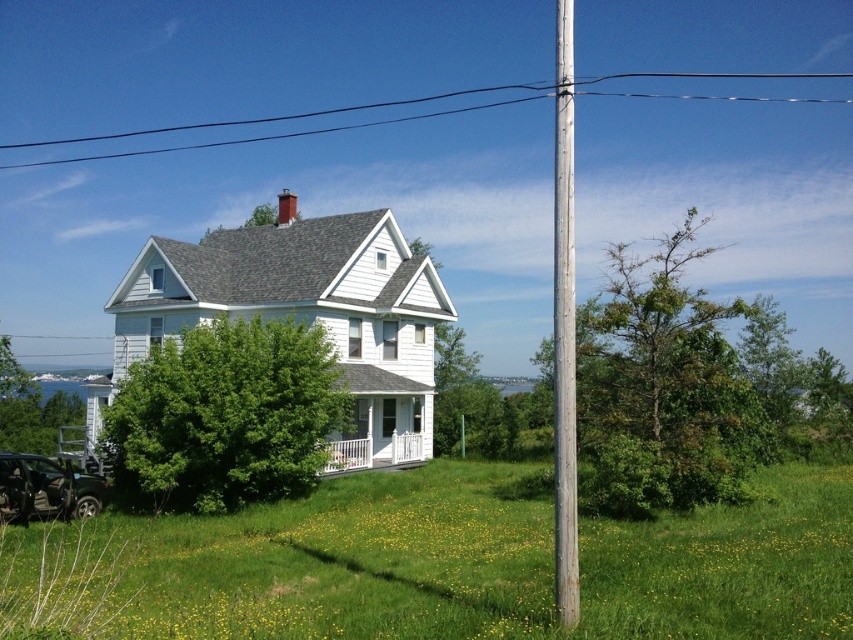
Question: Which point is farther to the camera?

Choices:
 (A) (245, 449)
 (B) (561, 346)

Answer: (A)

Question: Which object appears closest to the camera in this image?

Choices:
 (A) gray wooden pole at right
 (B) metallic black car at lower left
 (C) green leafy tree at center

Answer: (A)

Question: Is green rough wood pole at right positioned behind green leafy tree at center?

Choices:
 (A) yes
 (B) no

Answer: (B)

Question: Which of these objects is positioned closest to the green rough wood pole at right?

Choices:
 (A) black wire at upper center
 (B) green leafy tree at lower left

Answer: (B)

Question: Does black wire at upper center appear on the right side of green leafy tree at lower left?

Choices:
 (A) no
 (B) yes

Answer: (B)

Question: Where is green rough wood pole at right located in relation to gray wooden pole at right in the image?

Choices:
 (A) right
 (B) left

Answer: (A)